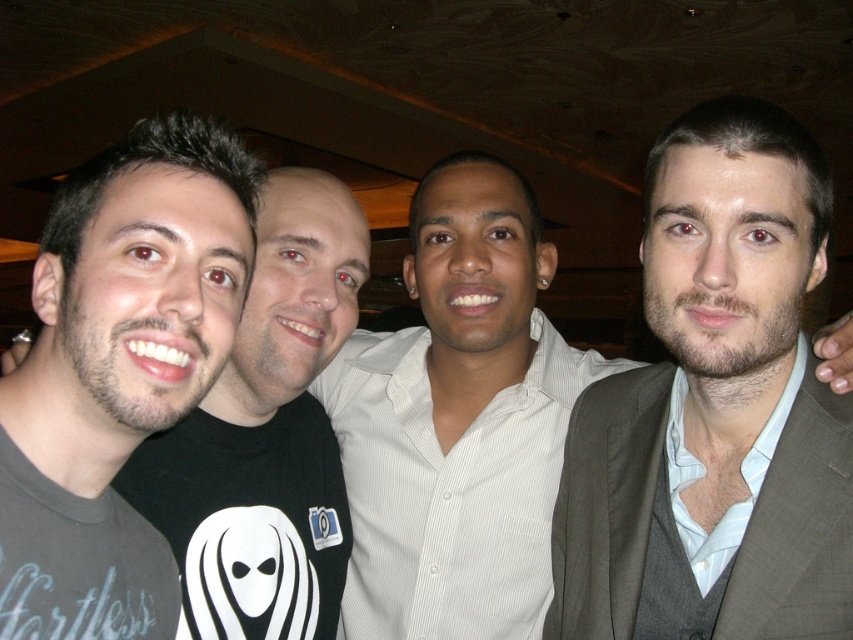
You are standing in the same room as the group and want to take a photo of the light brown suit at right. Where should you aim your camera to capture it?

You should aim your camera at point [714,403] to capture the light brown suit at right.